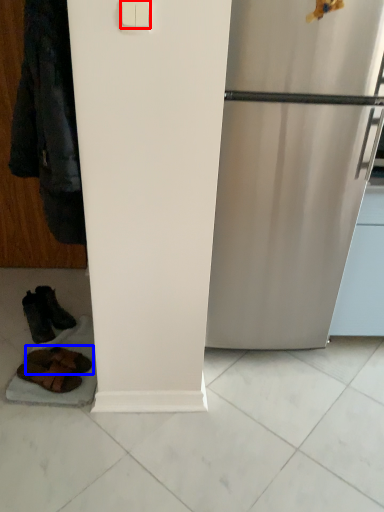
Question: Which point is closer to the camera, light switch (highlighted by a red box) or footwear (highlighted by a blue box)?

Choices:
 (A) light switch
 (B) footwear

Answer: (A)